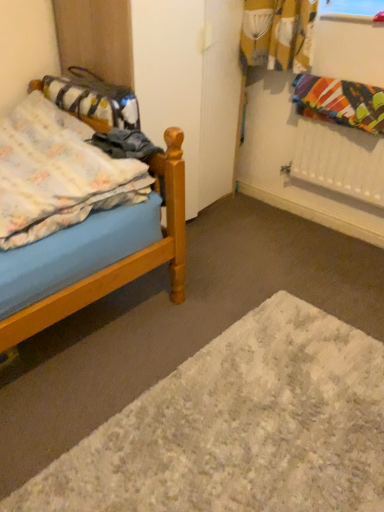
Question: Would you say white shaggy rug at lower center is to the left or to the right of fluffy cotton blanket at left, acting as the second blanket starting from the right, in the picture?

Choices:
 (A) left
 (B) right

Answer: (B)

Question: Relative to fluffy cotton blanket at left, the first blanket when ordered from left to right, is white shaggy rug at lower center in front or behind?

Choices:
 (A) front
 (B) behind

Answer: (A)

Question: Considering the real-world distances, which object is closest to the white shaggy rug at lower center?

Choices:
 (A) fluffy cotton blanket at left, acting as the second blanket starting from the right
 (B) fluffy fabric bag at left
 (C) multicolored fabric at upper right, marked as the 1th blanket in a right-to-left arrangement
 (D) wooden bed at left

Answer: (D)

Question: Which is nearer to the fluffy fabric bag at left?

Choices:
 (A) wooden bed at left
 (B) fluffy cotton blanket at left, acting as the second blanket starting from the right
 (C) white shaggy rug at lower center
 (D) multicolored fabric at upper right, marked as the 1th blanket in a right-to-left arrangement

Answer: (B)